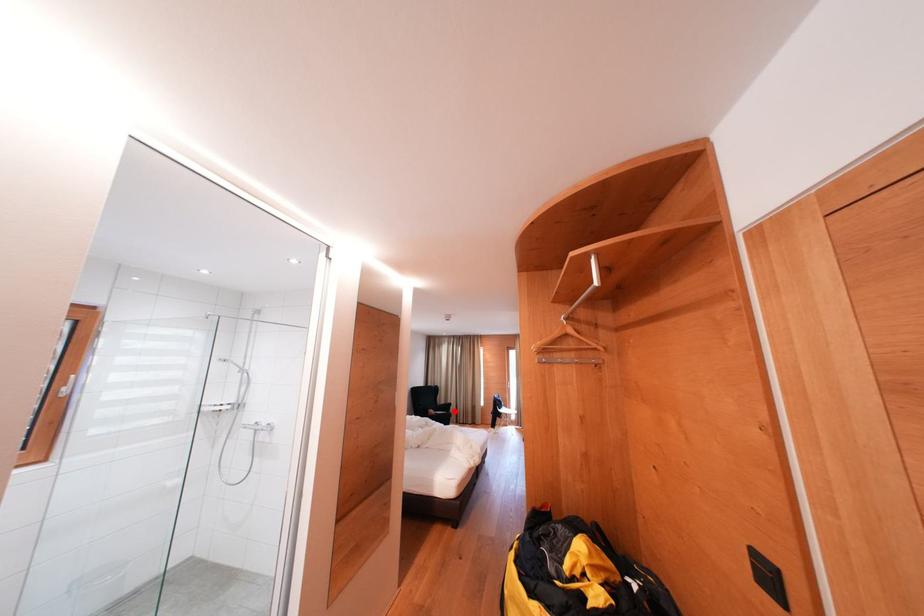
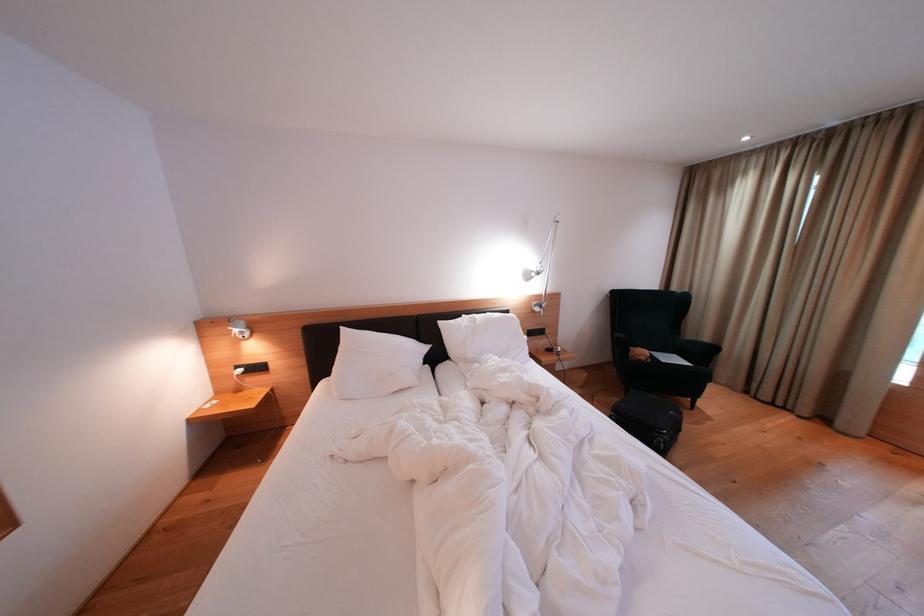
In the second image, find the point that corresponds to the highlighted location in the first image.

(710, 358)